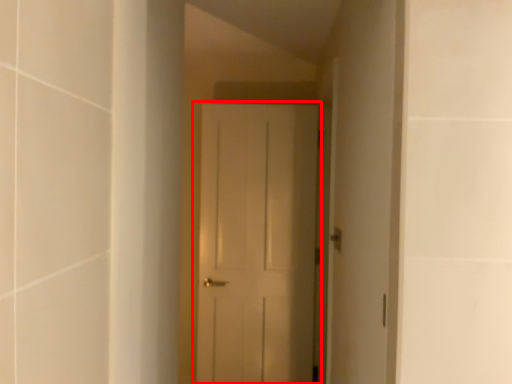
Question: From the image's perspective, what is the correct spatial positioning of door (annotated by the red box) in reference to door handle?

Choices:
 (A) below
 (B) above

Answer: (A)